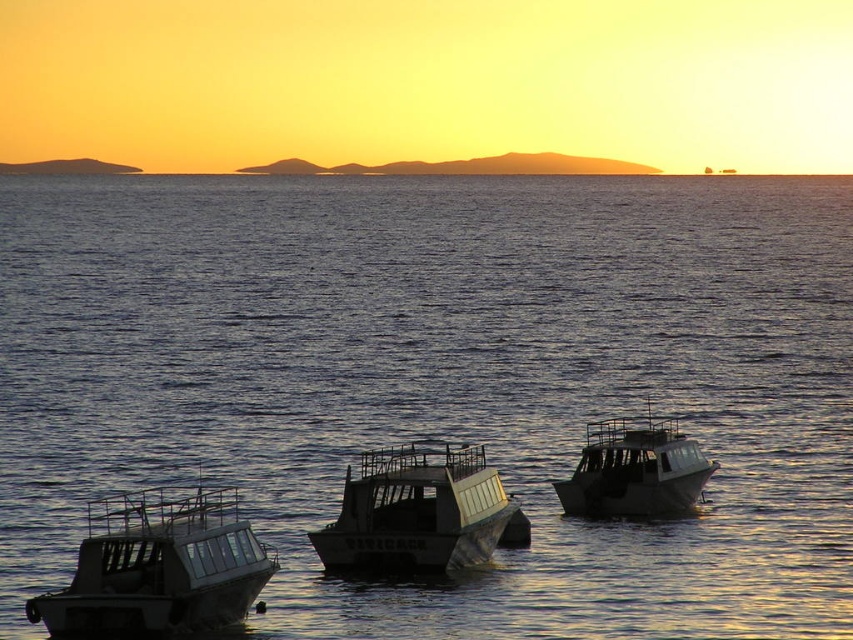
Question: In this image, where is metallic gray boat at lower left located relative to metallic gray boat at center?

Choices:
 (A) above
 (B) below

Answer: (A)

Question: Which point is closer to the camera?

Choices:
 (A) (363, 388)
 (B) (648, 502)
 (C) (86, 536)

Answer: (C)

Question: Can you confirm if dark blue water at center is smaller than metallic gray boat at lower left?

Choices:
 (A) no
 (B) yes

Answer: (A)

Question: Which point is closer to the camera?

Choices:
 (A) (405, 556)
 (B) (689, 438)
 (C) (231, 262)

Answer: (A)

Question: Which point appears farthest from the camera in this image?

Choices:
 (A) (380, 472)
 (B) (550, 634)
 (C) (122, 492)

Answer: (C)

Question: Where is dark blue water at center located in relation to metallic gray boat at center in the image?

Choices:
 (A) left
 (B) right

Answer: (A)